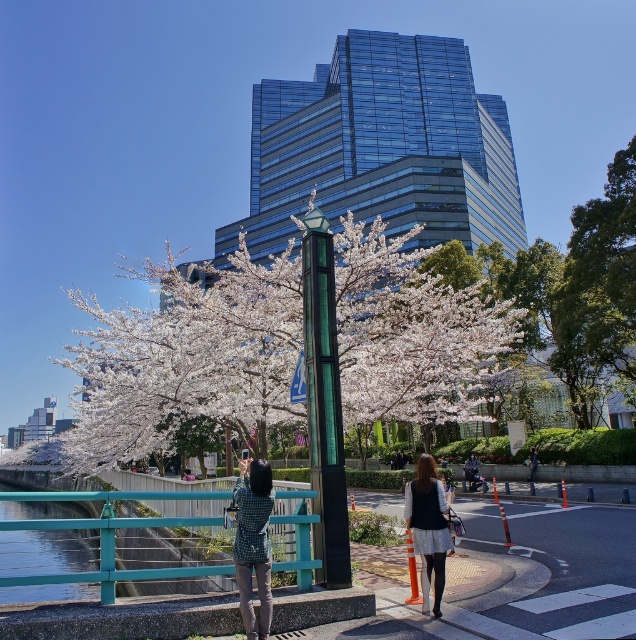
Locate an element on the screen. The image size is (636, 640). green glass pole at center is located at coordinates (322, 404).

Does green glass pole at center come in front of denim jacket at center?

Yes.

Is point (342, 524) less distant than point (530, 470)?

Yes, it is.

I want to click on green glass pole at center, so click(322, 404).

Is green leafy tree at upper right positioned in front of white textured skirt at center?

That is False.

Which is in front, point (555, 307) or point (439, 554)?

Point (439, 554) is in front.

Between point (574, 236) and point (420, 496), which one is positioned in front?

Positioned in front is point (420, 496).

This screenshot has width=636, height=640. I want to click on green leafy tree at upper right, so click(x=600, y=276).

Who is lower down, white blossoms at center or checkered fabric shirt at center?

checkered fabric shirt at center is below.

Who is more distant from viewer, (370, 316) or (270, 620)?

Positioned behind is point (370, 316).

Which is behind, point (162, 353) or point (263, 477)?

Positioned behind is point (162, 353).

Identify the location of white blossoms at center. This screenshot has width=636, height=640. (286, 349).